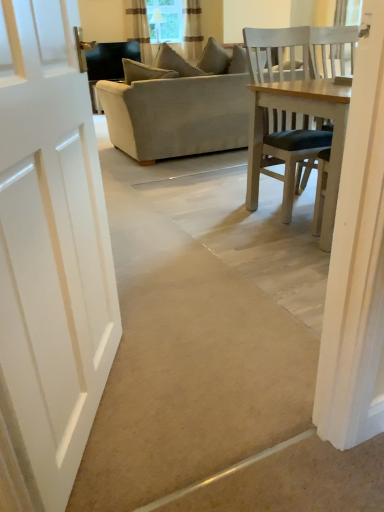
The height and width of the screenshot is (512, 384). I want to click on vacant region to the left of wooden chair at right, so click(x=290, y=242).